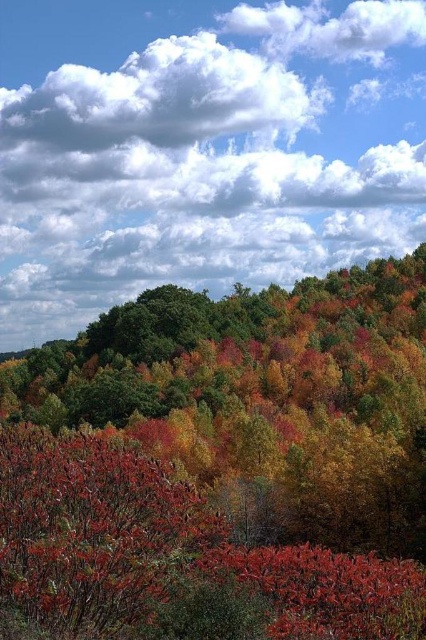
Between autumn foliage at center and white fluffy cloud at upper center, which one has less height?

autumn foliage at center

Where is `autumn foliage at center`? The height and width of the screenshot is (640, 426). autumn foliage at center is located at coordinates (224, 465).